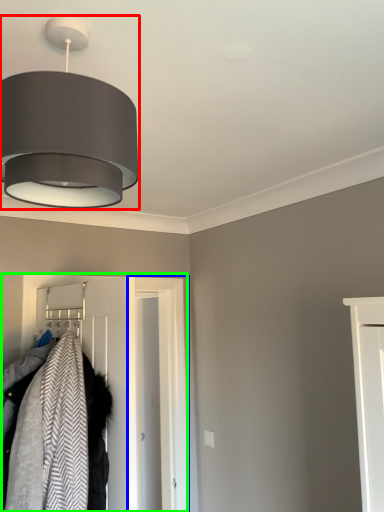
Question: Which object is positioned farthest from lamp (highlighted by a red box)? Select from door (highlighted by a blue box) and closet (highlighted by a green box).

Choices:
 (A) door
 (B) closet

Answer: (A)